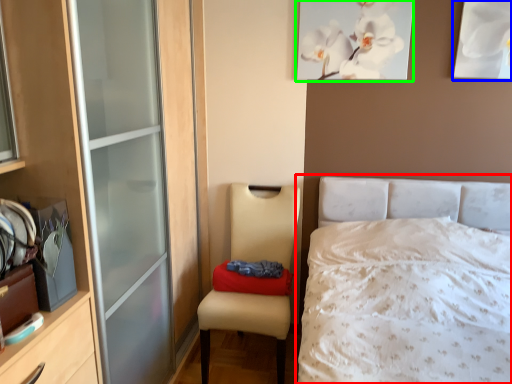
Question: Which object is positioned farthest from bed (highlighted by a red box)? Select from picture frame (highlighted by a blue box) and picture frame (highlighted by a green box).

Choices:
 (A) picture frame
 (B) picture frame

Answer: (A)